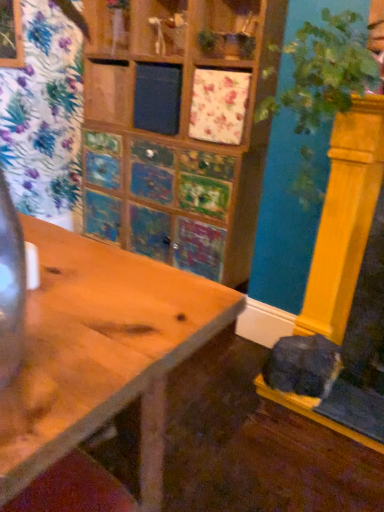
This screenshot has height=512, width=384. I want to click on free spot to the right of soft gray fur cat at lower right, so click(x=362, y=391).